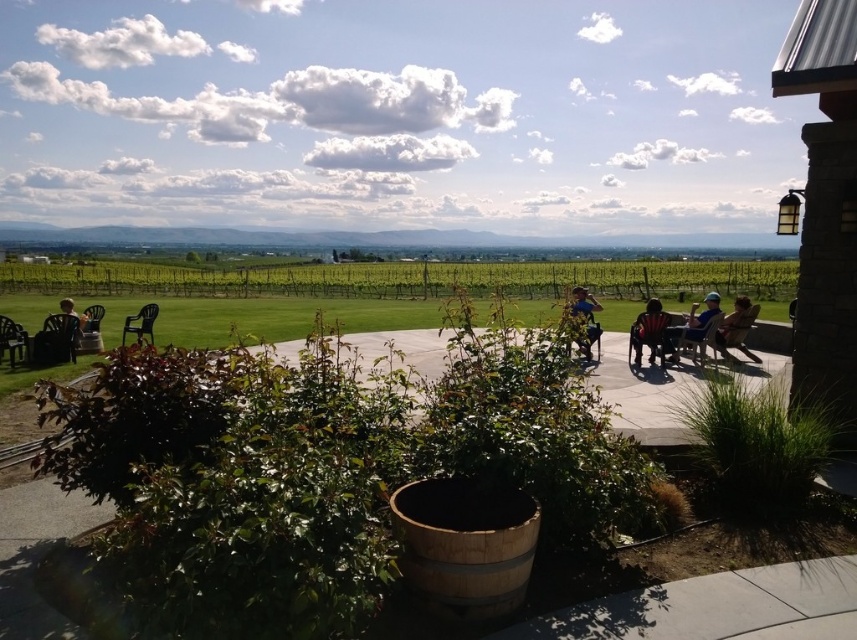
Question: Which point appears farthest from the camera in this image?

Choices:
 (A) (69, 305)
 (B) (732, 323)

Answer: (A)

Question: Which object is positioned farthest from the matte wood chair at center?

Choices:
 (A) matte black chair at left
 (B) matte black chair at center

Answer: (A)

Question: Can you confirm if blue denim jeans at center is positioned above matte black chair at left?

Choices:
 (A) yes
 (B) no

Answer: (B)

Question: Observing the image, what is the correct spatial positioning of green grass at center in reference to matte black chair at left?

Choices:
 (A) below
 (B) above

Answer: (B)

Question: Which object is closer to the camera taking this photo?

Choices:
 (A) green grass at center
 (B) matte black chair at left

Answer: (B)

Question: Is matte wood chair at center above blue denim jeans at center?

Choices:
 (A) yes
 (B) no

Answer: (A)